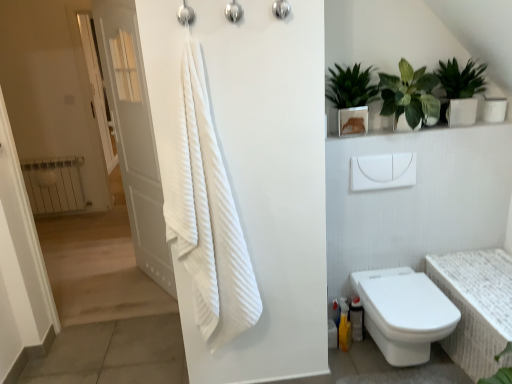
Question: Can you confirm if green glossy plant at upper right, acting as the 1th houseplant starting from the right, is taller than green leafy plant at upper right, arranged as the 2th houseplant when viewed from the left?

Choices:
 (A) yes
 (B) no

Answer: (B)

Question: From the image's perspective, is green glossy plant at upper right, acting as the 1th houseplant starting from the right, located above green leafy plant at upper right, arranged as the 2th houseplant when viewed from the left?

Choices:
 (A) yes
 (B) no

Answer: (A)

Question: Considering the relative sizes of green glossy plant at upper right, acting as the 1th houseplant starting from the right, and green leafy plant at upper right, arranged as the 2th houseplant when viewed from the left, in the image provided, is green glossy plant at upper right, acting as the 1th houseplant starting from the right, smaller than green leafy plant at upper right, arranged as the 2th houseplant when viewed from the left,?

Choices:
 (A) no
 (B) yes

Answer: (B)

Question: Is green glossy plant at upper right, acting as the 1th houseplant starting from the right, positioned before green leafy plant at upper right, which is the second houseplant from right to left?

Choices:
 (A) no
 (B) yes

Answer: (A)

Question: Is green glossy plant at upper right, the 3th houseplant from the left, positioned with its back to green leafy plant at upper right, arranged as the 2th houseplant when viewed from the left?

Choices:
 (A) yes
 (B) no

Answer: (B)

Question: Considering the positions of brushed metal shower head at upper center, arranged as the 2th shower when viewed from the right, and metallic silver shower head at upper center, the first shower viewed from the right, in the image, is brushed metal shower head at upper center, arranged as the 2th shower when viewed from the right, taller or shorter than metallic silver shower head at upper center, the first shower viewed from the right,?

Choices:
 (A) tall
 (B) short

Answer: (B)

Question: Considering the positions of brushed metal shower head at upper center, which ranks as the 2th shower in left-to-right order, and metallic silver shower head at upper center, the first shower viewed from the right, in the image, is brushed metal shower head at upper center, which ranks as the 2th shower in left-to-right order, wider or thinner than metallic silver shower head at upper center, the first shower viewed from the right,?

Choices:
 (A) wide
 (B) thin

Answer: (A)

Question: Considering their positions, is brushed metal shower head at upper center, which ranks as the 2th shower in left-to-right order, located in front of or behind metallic silver shower head at upper center, the third shower when ordered from left to right?

Choices:
 (A) behind
 (B) front

Answer: (B)

Question: Choose the correct answer: Is brushed metal shower head at upper center, which ranks as the 2th shower in left-to-right order, inside metallic silver shower head at upper center, the first shower viewed from the right, or outside it?

Choices:
 (A) inside
 (B) outside

Answer: (B)

Question: From a real-world perspective, relative to green leafy plant at upper right, which is the second houseplant from right to left, is white wood door at left vertically above or below?

Choices:
 (A) above
 (B) below

Answer: (B)

Question: Is white wood door at left to the left or to the right of green leafy plant at upper right, arranged as the 2th houseplant when viewed from the left, in the image?

Choices:
 (A) right
 (B) left

Answer: (B)

Question: In terms of height, does white wood door at left look taller or shorter compared to green leafy plant at upper right, which is the second houseplant from right to left?

Choices:
 (A) short
 (B) tall

Answer: (B)

Question: From the image's perspective, is white wood door at left located above or below green leafy plant at upper right, arranged as the 2th houseplant when viewed from the left?

Choices:
 (A) below
 (B) above

Answer: (A)

Question: Do you think brushed metal shower at upper center, acting as the 3th shower starting from the right, is within green glossy plant at upper right, which appears as the 1th houseplant when viewed from the left, or outside of it?

Choices:
 (A) inside
 (B) outside

Answer: (B)

Question: From a real-world perspective, is brushed metal shower at upper center, acting as the 3th shower starting from the right, positioned above or below green glossy plant at upper right, which appears as the 1th houseplant when viewed from the left?

Choices:
 (A) above
 (B) below

Answer: (A)